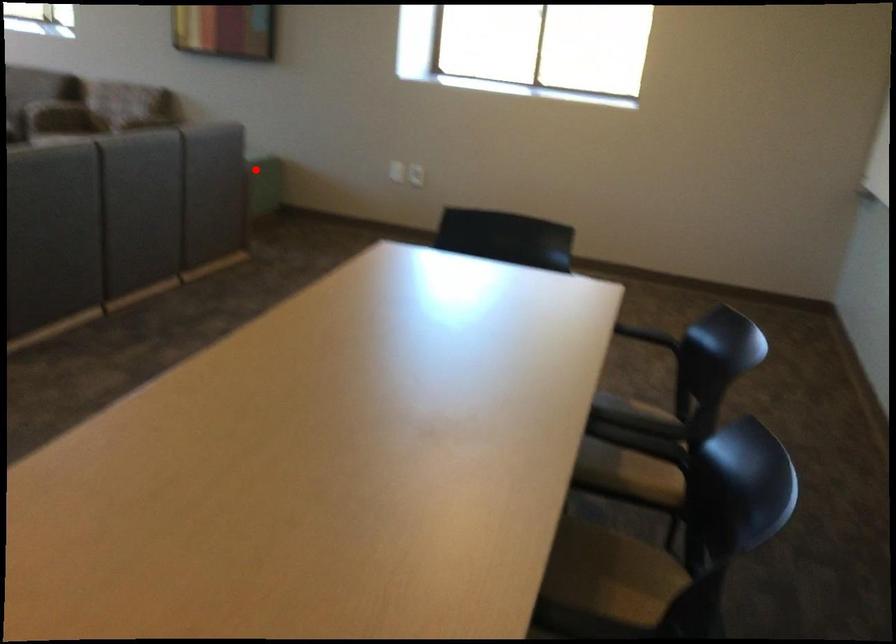
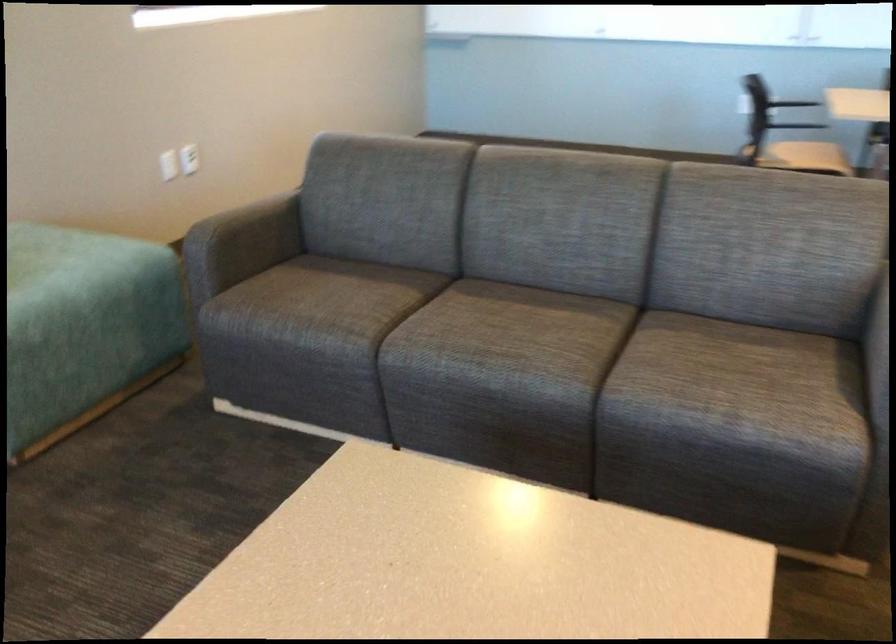
Where in the second image is the point corresponding to the highlighted location from the first image?

(56, 251)